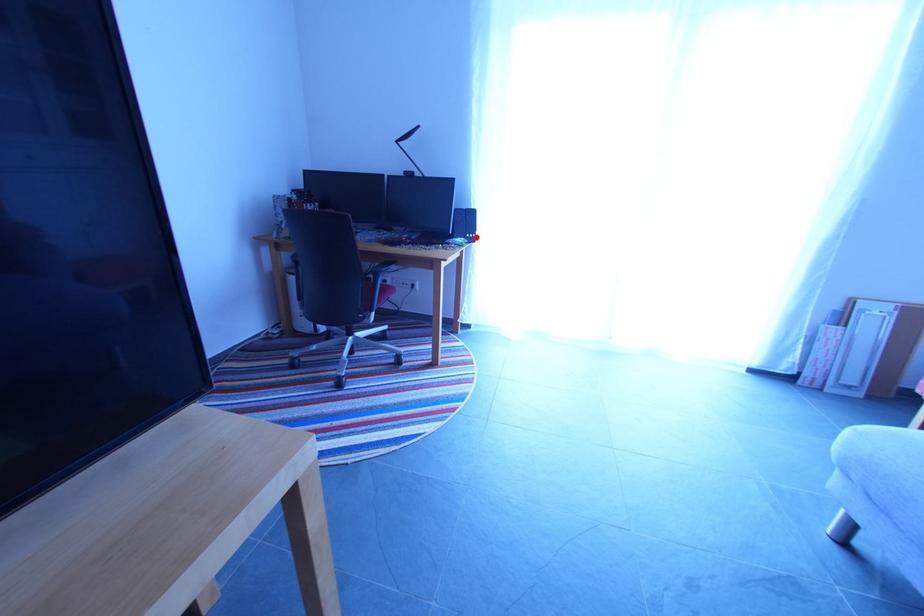
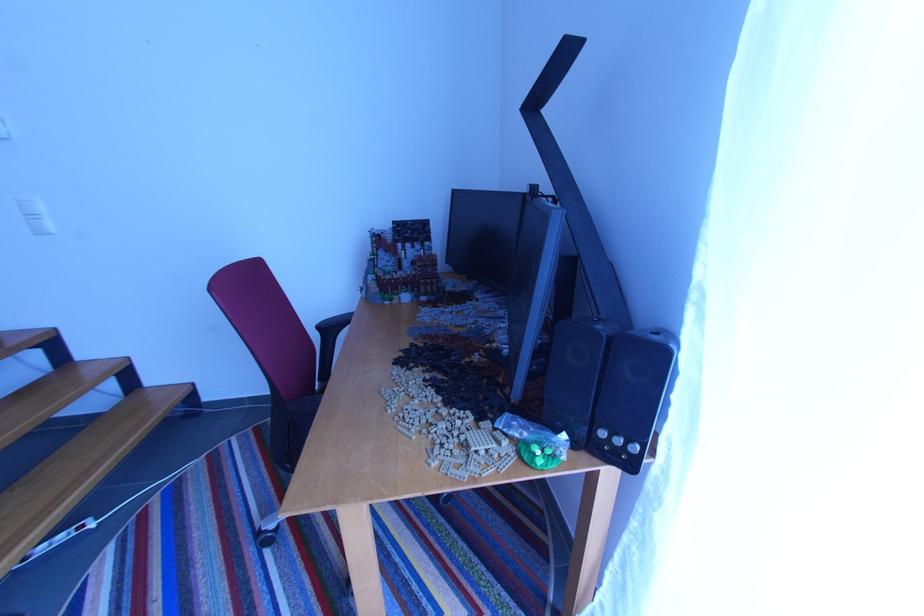
In the second image, find the point that corresponds to the highlighted location in the first image.

(623, 443)